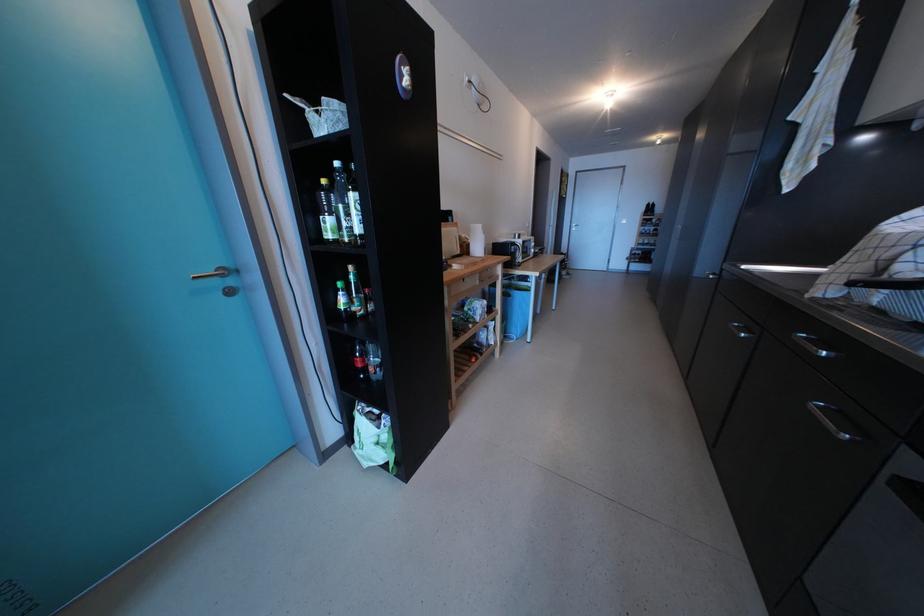
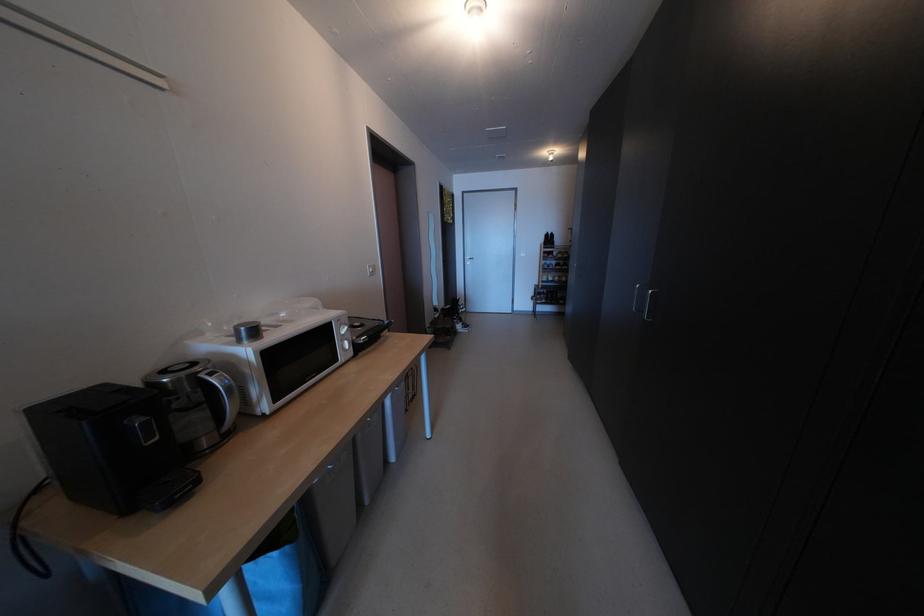
Which direction would the cameraman need to move to produce the second image?

The movement direction of the cameraman is right, forward.